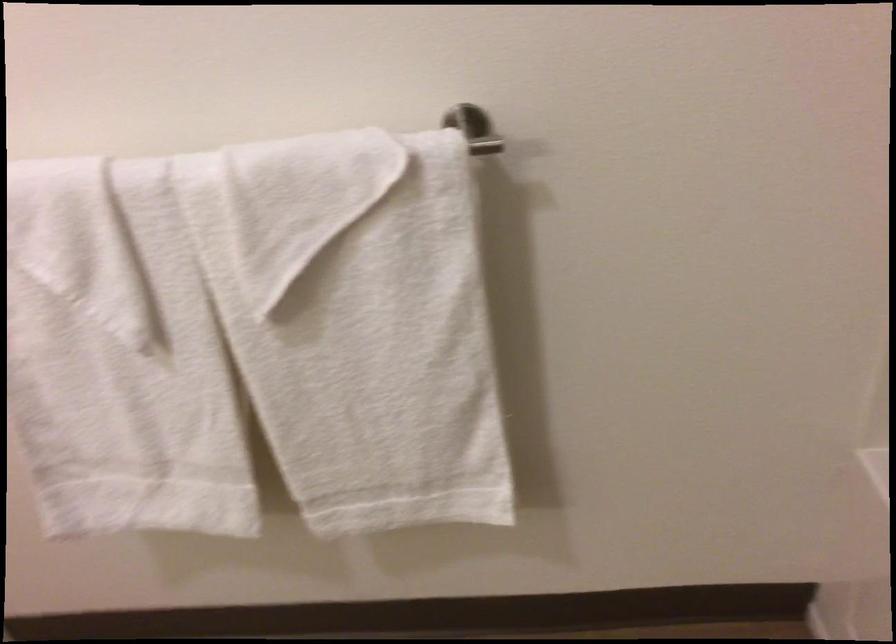
This screenshot has width=896, height=644. What do you see at coordinates (485, 146) in the screenshot? I see `the metal towel bar` at bounding box center [485, 146].